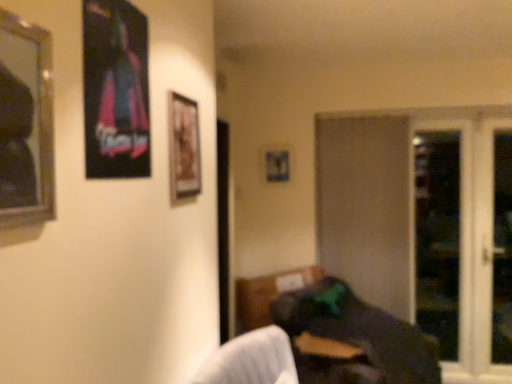
Question: From the image's perspective, is silver-framed mirror at left, which is the first picture frame from front to back, located above or below beige matte screen door at center-right, which ranks as the 1th screen door in left-to-right order?

Choices:
 (A) below
 (B) above

Answer: (B)

Question: Is point (49, 182) closer or farther from the camera than point (320, 231)?

Choices:
 (A) farther
 (B) closer

Answer: (B)

Question: Which is farther from the transparent glass screen door at right, acting as the third screen door starting from the left?

Choices:
 (A) dark fabric bean bag at lower right
 (B) white glass screen door at right, the 1th screen door positioned from the right
 (C) silver-framed mirror at left, positioned as the 4th picture frame in right-to-left order
 (D) transparent glass screen door at right, marked as the second screen door in a left-to-right arrangement
 (E) beige matte screen door at center-right, the 4th screen door in the right-to-left sequence

Answer: (C)

Question: Which of these objects is positioned farthest from the metallic silver picture frame at center, acting as the fourth picture frame starting from the front?

Choices:
 (A) dark fabric bean bag at lower right
 (B) beige matte screen door at center-right, which ranks as the 1th screen door in left-to-right order
 (C) transparent glass screen door at right, the 2th screen door positioned from the right
 (D) metallic poster at upper left, the second picture frame in the left-to-right sequence
 (E) wooden framed picture at center, the 3th picture frame positioned from the left

Answer: (D)